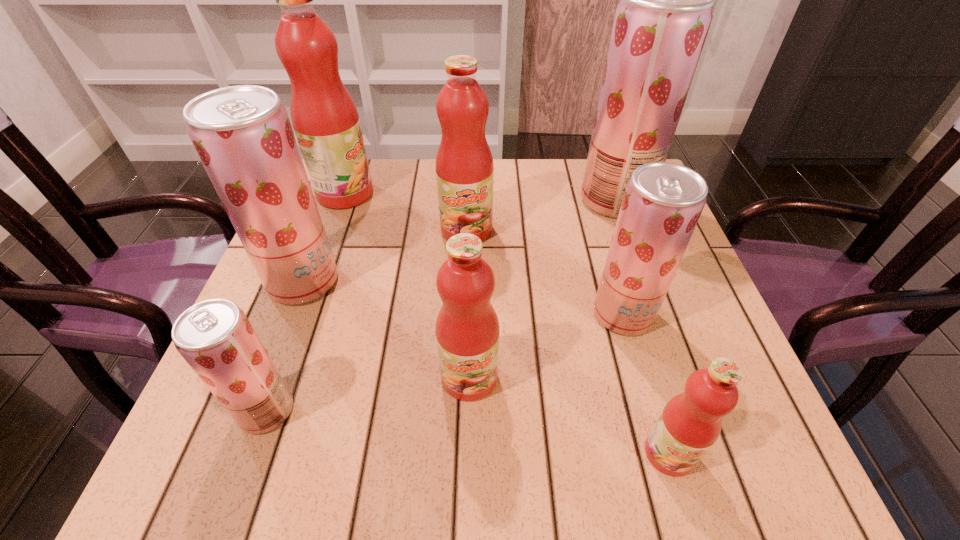
At what (x,y) coordinates should I click in order to perform the action: click on the farthest pink fruit juice. Please return your answer as a coordinate pair (x, y). Looking at the image, I should click on (325, 119).

The width and height of the screenshot is (960, 540). In order to click on the leftmost pink fruit juice in this screenshot , I will do `click(325, 119)`.

The image size is (960, 540). What are the coordinates of `the farthest strawberry fruit juice` in the screenshot? It's located at (661, 23).

I want to click on the second biggest strawberry fruit juice, so click(242, 134).

You are a GUI agent. You are given a task and a screenshot of the screen. Output one action in this format:
    pyautogui.click(x=<x>, y=<y>)
    Task: Click on the third nearest pink fruit juice
    
    Given the screenshot: What is the action you would take?
    pyautogui.click(x=464, y=166)

Where is `the third biggest strawberry fruit juice`? The image size is (960, 540). the third biggest strawberry fruit juice is located at coordinates (663, 201).

Where is `the third biggest pink fruit juice`? the third biggest pink fruit juice is located at coordinates coord(467,328).

Find the location of a particular element. the smallest strawberry fruit juice is located at coordinates (216, 339).

You are a GUI agent. You are given a task and a screenshot of the screen. Output one action in this format:
    pyautogui.click(x=<x>, y=<y>)
    Task: Click on the smallest pink fruit juice
    This screenshot has height=540, width=960.
    Given the screenshot: What is the action you would take?
    pyautogui.click(x=690, y=423)

Where is `the rightmost pink fruit juice`? This screenshot has height=540, width=960. the rightmost pink fruit juice is located at coordinates (690, 423).